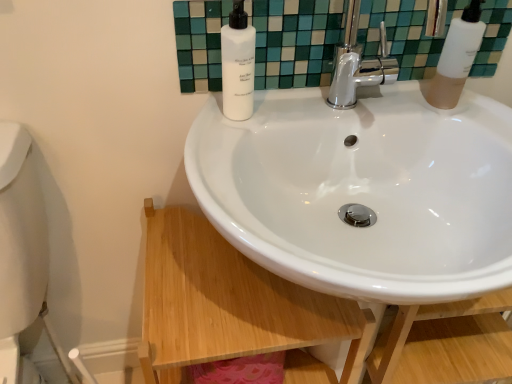
Question: Considering their positions, is white glossy sink at center located in front of or behind white matte bottle at upper center, the first soap dispenser when ordered from left to right?

Choices:
 (A) behind
 (B) front

Answer: (B)

Question: Considering the positions of white glossy sink at center and white matte bottle at upper center, which ranks as the second soap dispenser in right-to-left order, in the image, is white glossy sink at center wider or thinner than white matte bottle at upper center, which ranks as the second soap dispenser in right-to-left order,?

Choices:
 (A) wide
 (B) thin

Answer: (A)

Question: Estimate the real-world distances between objects in this image. Which object is closer to the white matte bottle at upper right, arranged as the 2th soap dispenser when viewed from the left?

Choices:
 (A) white glossy mirror at upper center
 (B) white matte bottle at upper center, the first soap dispenser when ordered from left to right
 (C) white glossy wood at lower center
 (D) white glossy sink at center

Answer: (A)

Question: Considering the real-world distances, which object is farthest from the white matte bottle at upper right, acting as the first soap dispenser starting from the right?

Choices:
 (A) white glossy mirror at upper center
 (B) white glossy sink at center
 (C) white matte bottle at upper center, which ranks as the second soap dispenser in right-to-left order
 (D) white glossy wood at lower center

Answer: (D)